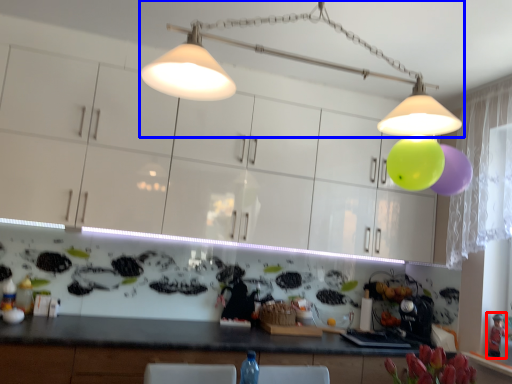
Question: Among these objects, which one is nearest to the camera, toy (highlighted by a red box) or lamp (highlighted by a blue box)?

Choices:
 (A) toy
 (B) lamp

Answer: (B)